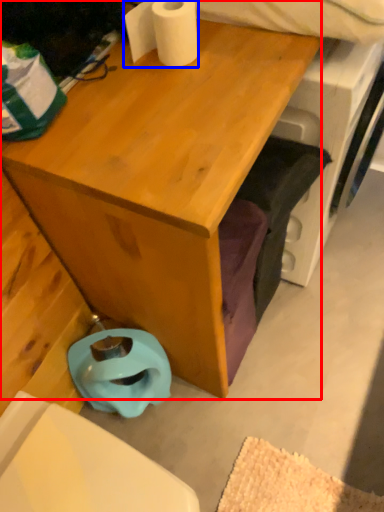
Question: Which object is further to the camera taking this photo, desk (highlighted by a red box) or toilet paper (highlighted by a blue box)?

Choices:
 (A) desk
 (B) toilet paper

Answer: (B)